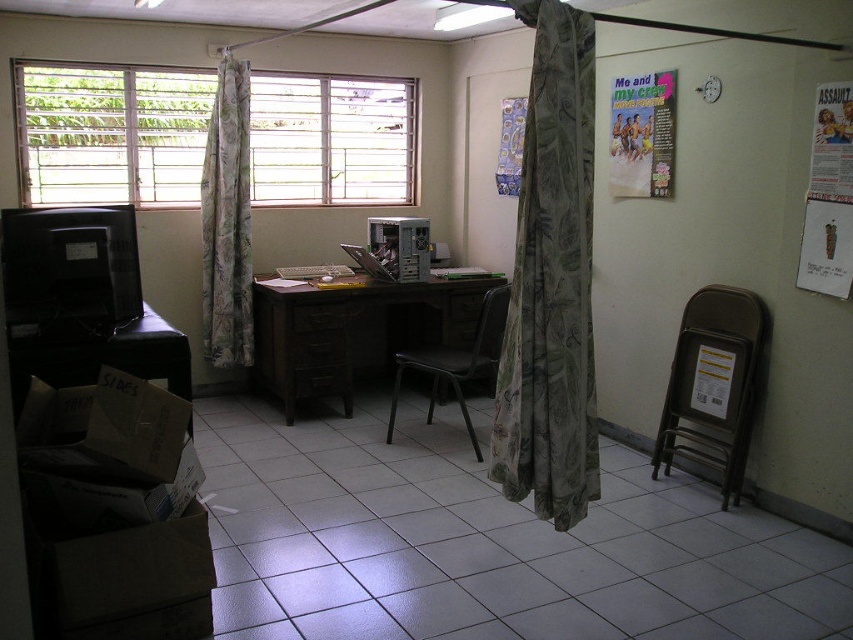
Is floral fabric curtain at left wider than paperboard poster at upper right?

Indeed, floral fabric curtain at left has a greater width compared to paperboard poster at upper right.

Between floral fabric curtain at left and paperboard poster at upper right, which one appears on the left side from the viewer's perspective?

Positioned to the left is floral fabric curtain at left.

Is point (247, 262) farther from viewer compared to point (838, 84)?

Yes.

Identify the location of floral fabric curtain at left. This screenshot has height=640, width=853. (227, 220).

Can you confirm if white textured window at upper center is positioned to the right of brown cardboard box at lower left?

No, white textured window at upper center is not to the right of brown cardboard box at lower left.

Who is higher up, white textured window at upper center or brown cardboard box at lower left?

white textured window at upper center is higher up.

Looking at this image, who is more distant from viewer, (152,100) or (143,612)?

The point (152,100) is more distant.

Where is `white textured window at upper center`? The width and height of the screenshot is (853, 640). white textured window at upper center is located at coordinates (109, 132).

Who is more forward, (415, 362) or (453, 296)?

Positioned in front is point (415, 362).

Is black metal chair at center shorter than brown wood drawer at center?

No.

Is point (489, 312) positioned in front of point (479, 305)?

Yes, point (489, 312) is closer to viewer.

I want to click on black metal chair at center, so click(457, 362).